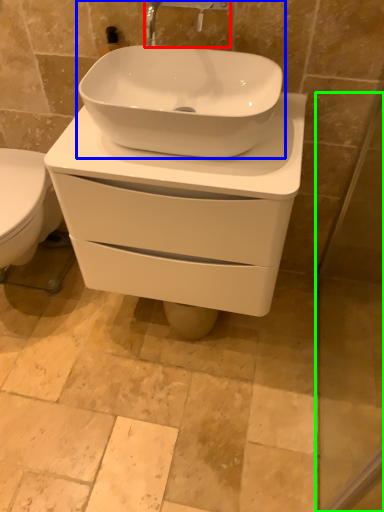
Question: Which object is the farthest from tap (highlighted by a red box)? Choose among these: sink (highlighted by a blue box) or screen door (highlighted by a green box).

Choices:
 (A) sink
 (B) screen door

Answer: (B)